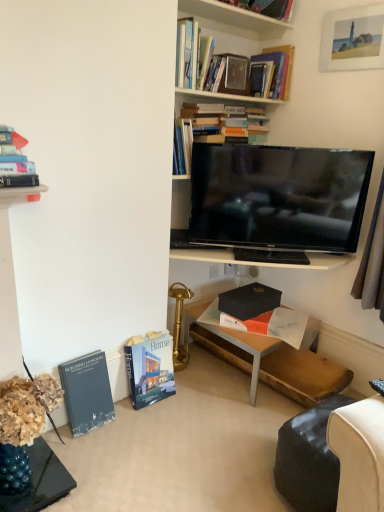
Question: Considering the relative sizes of matte white picture frame at upper right and hardcover book at upper left, which is the 4th book in bottom-to-top order, in the image provided, is matte white picture frame at upper right bigger than hardcover book at upper left, which is the 4th book in bottom-to-top order,?

Choices:
 (A) yes
 (B) no

Answer: (A)

Question: Is matte white picture frame at upper right thinner than hardcover book at upper left, which is the 4th book in bottom-to-top order?

Choices:
 (A) no
 (B) yes

Answer: (B)

Question: Is the surface of matte white picture frame at upper right in direct contact with hardcover book at upper left, arranged as the third book when viewed from the top?

Choices:
 (A) no
 (B) yes

Answer: (A)

Question: Is matte white picture frame at upper right taller than hardcover book at upper left, which is the 4th book in bottom-to-top order?

Choices:
 (A) no
 (B) yes

Answer: (B)

Question: Is matte white picture frame at upper right further to camera compared to hardcover book at upper left, which is the 4th book in bottom-to-top order?

Choices:
 (A) yes
 (B) no

Answer: (A)

Question: In terms of size, does matte black table at center appear bigger or smaller than hardcover book at lower left, arranged as the first book when ordered from the bottom?

Choices:
 (A) big
 (B) small

Answer: (A)

Question: Is matte black table at center taller or shorter than hardcover book at lower left, arranged as the first book when ordered from the bottom?

Choices:
 (A) short
 (B) tall

Answer: (A)

Question: Considering the positions of point (231, 337) and point (96, 376), is point (231, 337) closer or farther from the camera than point (96, 376)?

Choices:
 (A) farther
 (B) closer

Answer: (A)

Question: Considering the positions of matte black table at center and hardcover book at lower left, arranged as the first book when ordered from the bottom, in the image, is matte black table at center wider or thinner than hardcover book at lower left, arranged as the first book when ordered from the bottom,?

Choices:
 (A) thin
 (B) wide

Answer: (B)

Question: Considering the positions of matte black table at center and hardcover book at lower left, positioned as the second book in bottom-to-top order, in the image, is matte black table at center wider or thinner than hardcover book at lower left, positioned as the second book in bottom-to-top order,?

Choices:
 (A) thin
 (B) wide

Answer: (B)

Question: From the image's perspective, is matte black table at center located above or below hardcover book at lower left, positioned as the second book in bottom-to-top order?

Choices:
 (A) above
 (B) below

Answer: (A)

Question: From their relative heights in the image, would you say matte black table at center is taller or shorter than hardcover book at lower left, positioned as the second book in bottom-to-top order?

Choices:
 (A) short
 (B) tall

Answer: (A)

Question: Considering the positions of point pyautogui.click(x=223, y=343) and point pyautogui.click(x=142, y=365), is point pyautogui.click(x=223, y=343) closer or farther from the camera than point pyautogui.click(x=142, y=365)?

Choices:
 (A) farther
 (B) closer

Answer: (A)

Question: From the image's perspective, relative to black glossy tv at upper center, is black matte box at center, which appears as the 3th book when ordered from the bottom, above or below?

Choices:
 (A) below
 (B) above

Answer: (A)

Question: From a real-world perspective, is black matte box at center, which is counted as the 4th book, starting from the top, physically located above or below black glossy tv at upper center?

Choices:
 (A) above
 (B) below

Answer: (B)